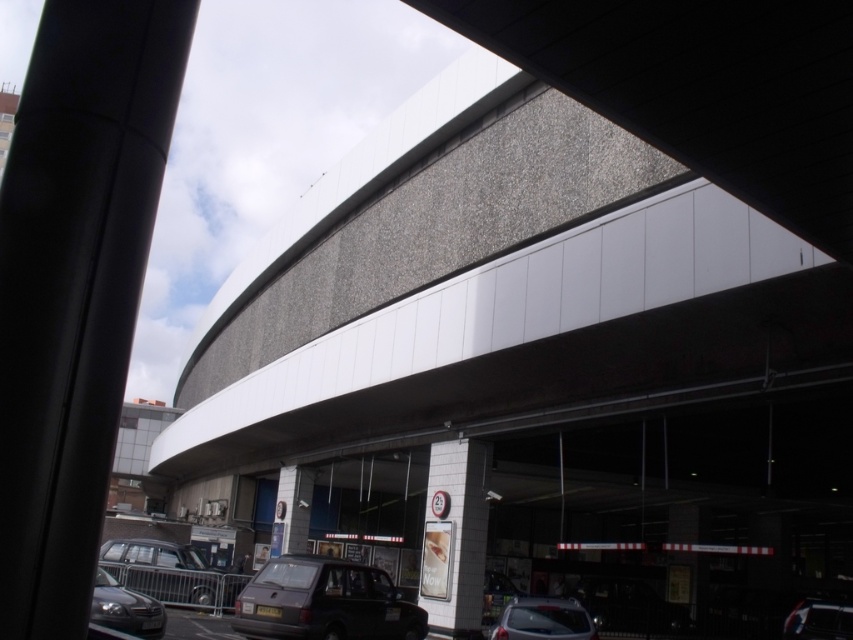
Question: Among these points, which one is nearest to the camera?

Choices:
 (A) pyautogui.click(x=135, y=616)
 (B) pyautogui.click(x=141, y=561)

Answer: (A)

Question: Is dark gray matte car at lower center to the left of white matte pillar at center from the viewer's perspective?

Choices:
 (A) yes
 (B) no

Answer: (A)

Question: Can you confirm if metallic silver car at lower left is wider than shiny silver sedan at lower left?

Choices:
 (A) yes
 (B) no

Answer: (A)

Question: Which object is positioned farthest from the metallic silver car at lower left?

Choices:
 (A) white matte pillar at center
 (B) granite-like overpass at upper center
 (C) shiny silver car at lower right
 (D) dark gray matte car at lower center

Answer: (C)

Question: Is granite-like overpass at upper center wider than shiny silver car at lower right?

Choices:
 (A) yes
 (B) no

Answer: (A)

Question: Which object is the closest to the metallic gray car at lower center?

Choices:
 (A) granite-like overpass at upper center
 (B) metallic silver car at lower left

Answer: (B)